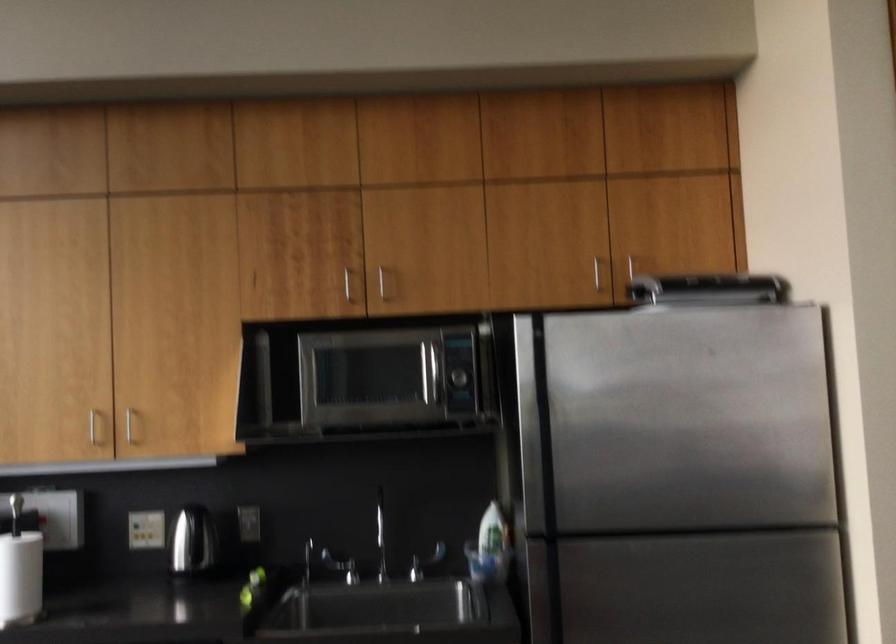
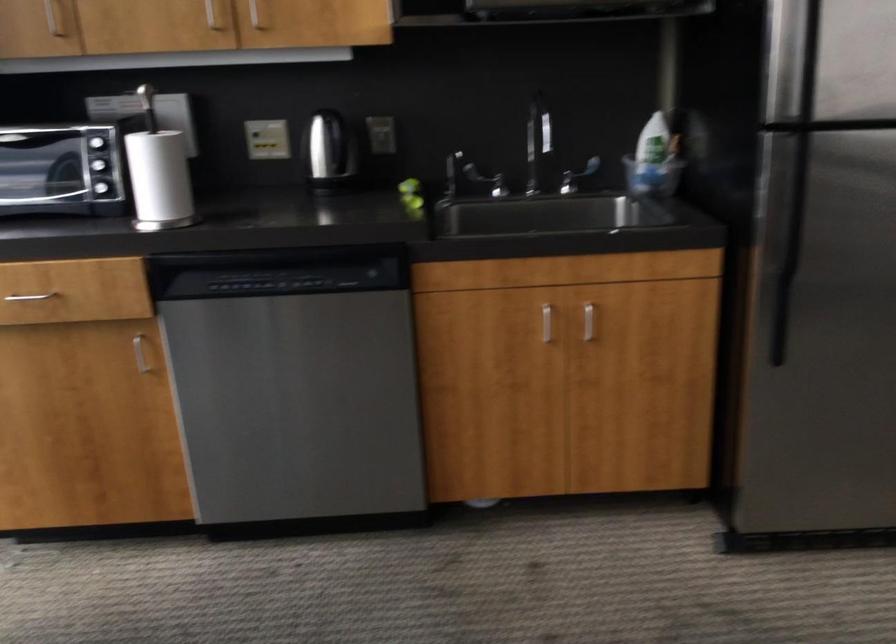
In a continuous first-person perspective shot, in which direction is the camera moving?

The cameraman moved toward left, forward.